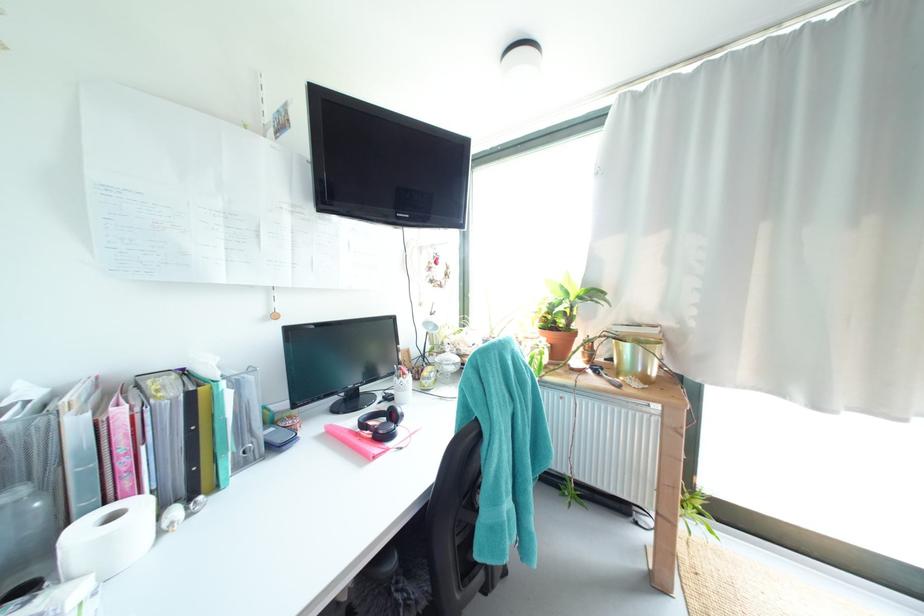
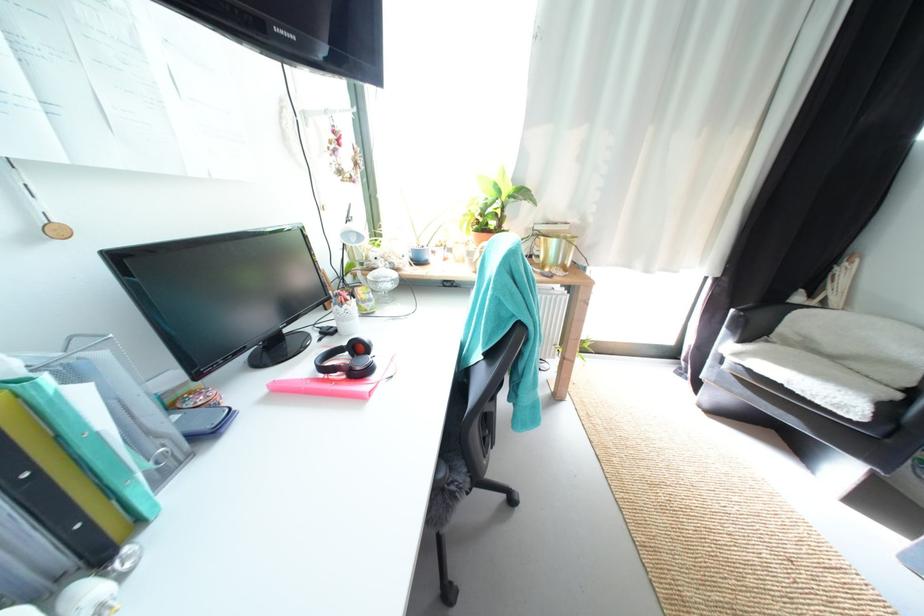
The point at (407,379) is marked in the first image. Where is the corresponding point in the second image?

(348, 306)